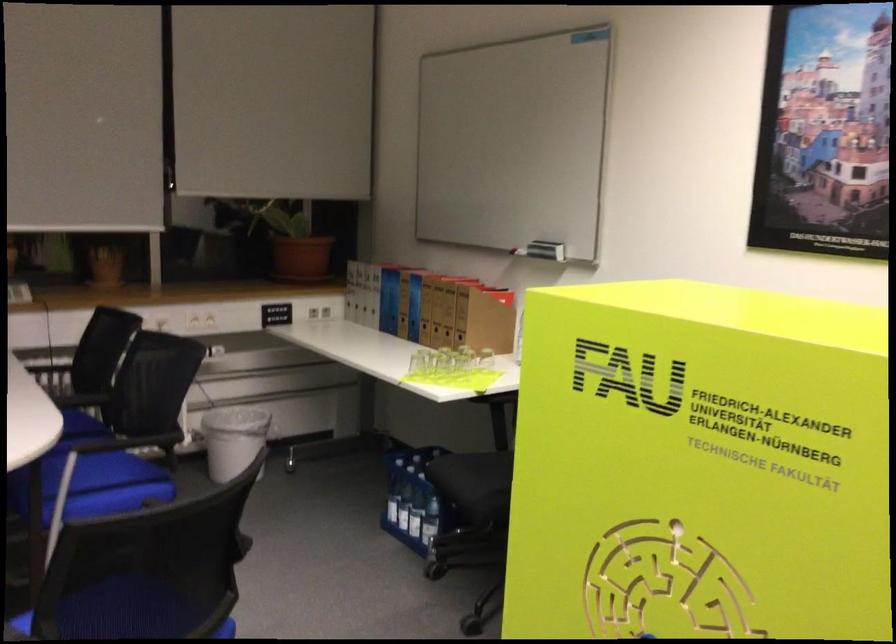
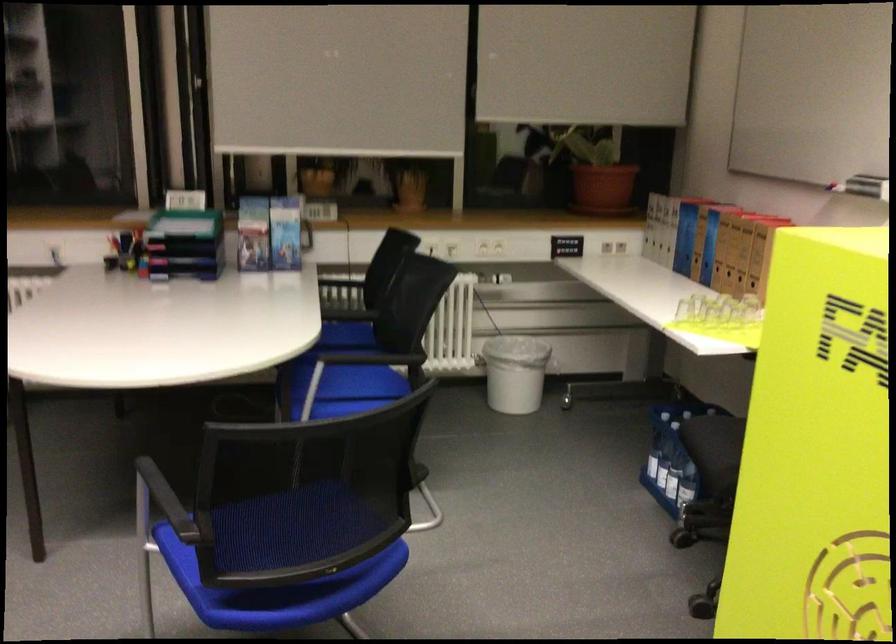
Find the pixel in the second image that matches the point at 402,511 in the first image.

(661, 465)